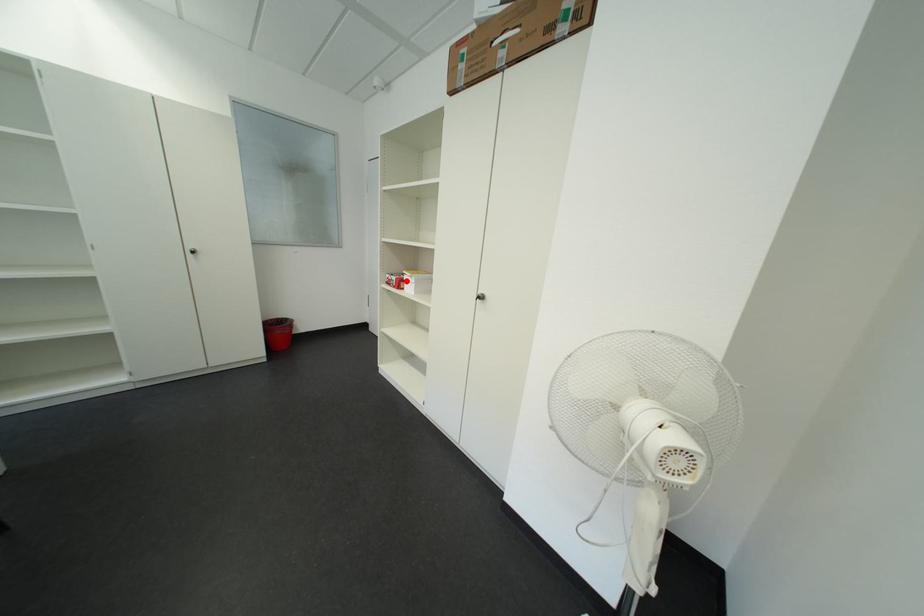
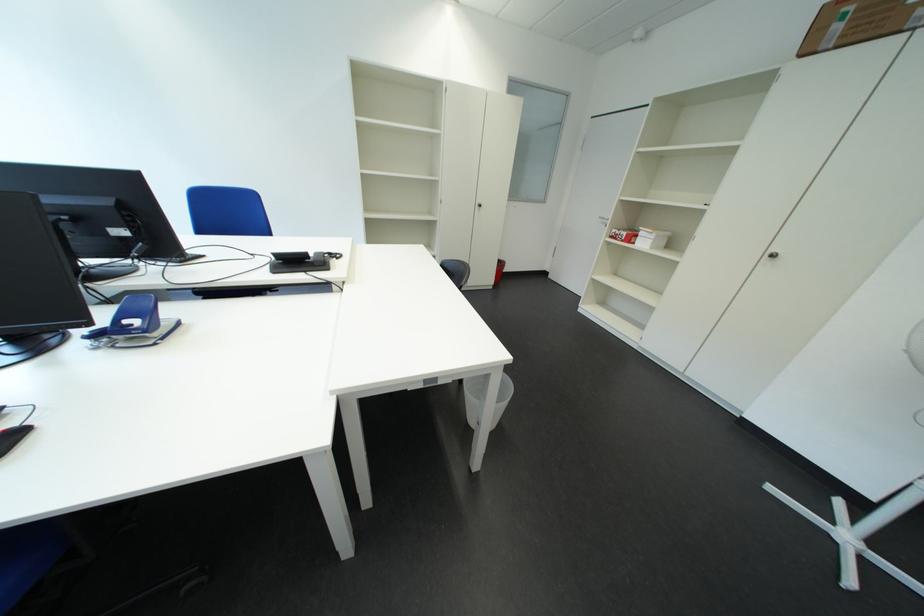
Locate, in the second image, the point that corresponds to the highlighted location in the first image.

(637, 236)